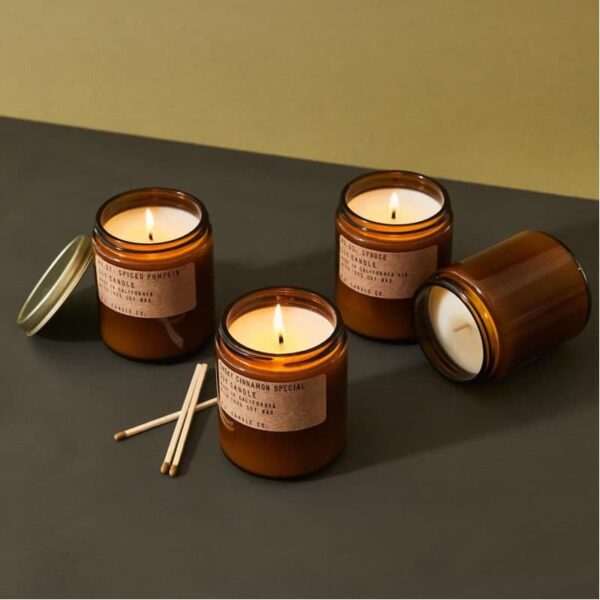
This screenshot has height=600, width=600. I want to click on counter, so click(312, 534).